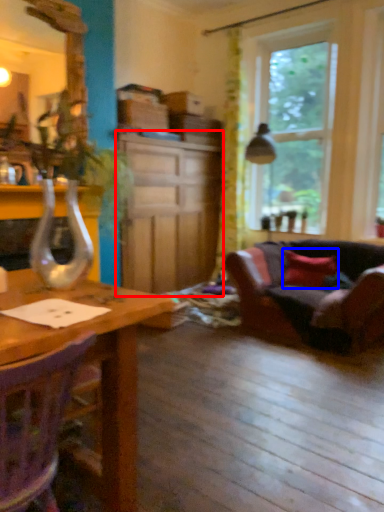
Question: Which point is further to the camera, cabinetry (highlighted by a red box) or pillow (highlighted by a blue box)?

Choices:
 (A) cabinetry
 (B) pillow

Answer: (B)